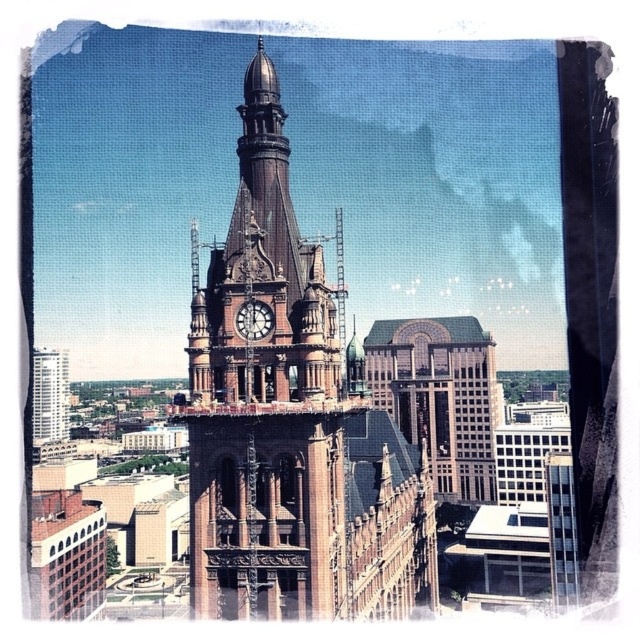
Does brown brick clock tower at center appear on the right side of polished brass clock at center?

In fact, brown brick clock tower at center is to the left of polished brass clock at center.

Does brown brick clock tower at center have a greater height compared to polished brass clock at center?

Correct, brown brick clock tower at center is much taller as polished brass clock at center.

Find the location of a particular element. The width and height of the screenshot is (640, 640). brown brick clock tower at center is located at coordinates (291, 422).

Is point (483, 362) closer to viewer compared to point (54, 349)?

Yes, point (483, 362) is in front of point (54, 349).

Can you confirm if brick building at center is taller than white glass skyscraper at left?

Yes, brick building at center is taller than white glass skyscraper at left.

Who is more distant from viewer, (454, 428) or (35, 388)?

Positioned behind is point (35, 388).

Find the location of a particular element. brick building at center is located at coordinates (440, 397).

Can you confirm if brown brick clock tower at center is positioned to the left of white glass skyscraper at left?

No, brown brick clock tower at center is not to the left of white glass skyscraper at left.

How much distance is there between brown brick clock tower at center and white glass skyscraper at left?

The distance of brown brick clock tower at center from white glass skyscraper at left is 114.09 feet.

Does point (253, 394) lie in front of point (44, 353)?

Yes, point (253, 394) is in front of point (44, 353).

Locate an element on the screen. The width and height of the screenshot is (640, 640). brown brick clock tower at center is located at coordinates (291, 422).